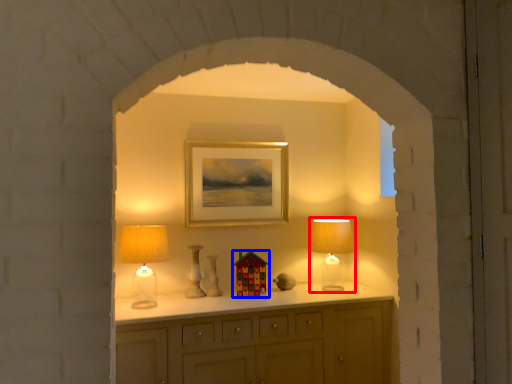
Question: Which of the following is the closest to the observer, table lamp (highlighted by a red box) or toy (highlighted by a blue box)?

Choices:
 (A) table lamp
 (B) toy

Answer: (A)